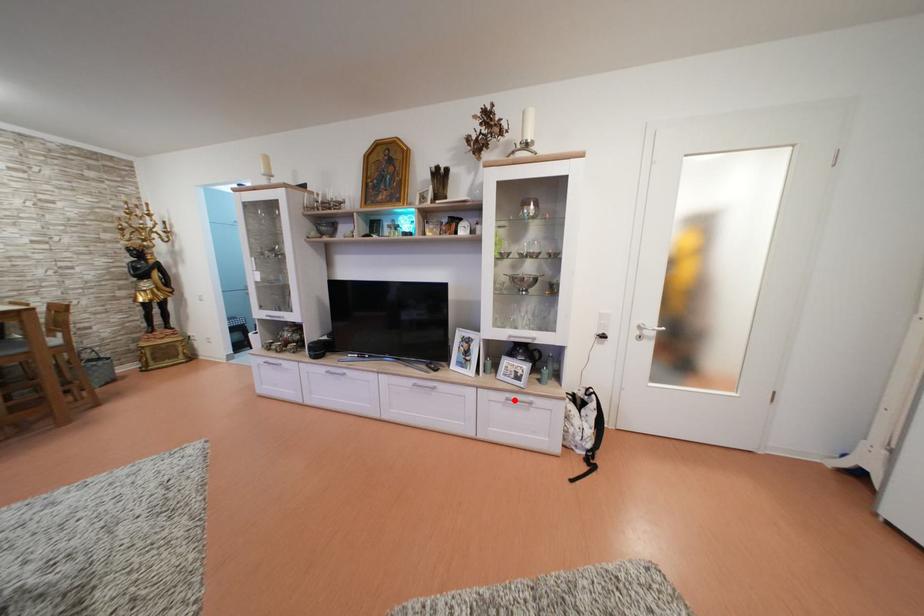
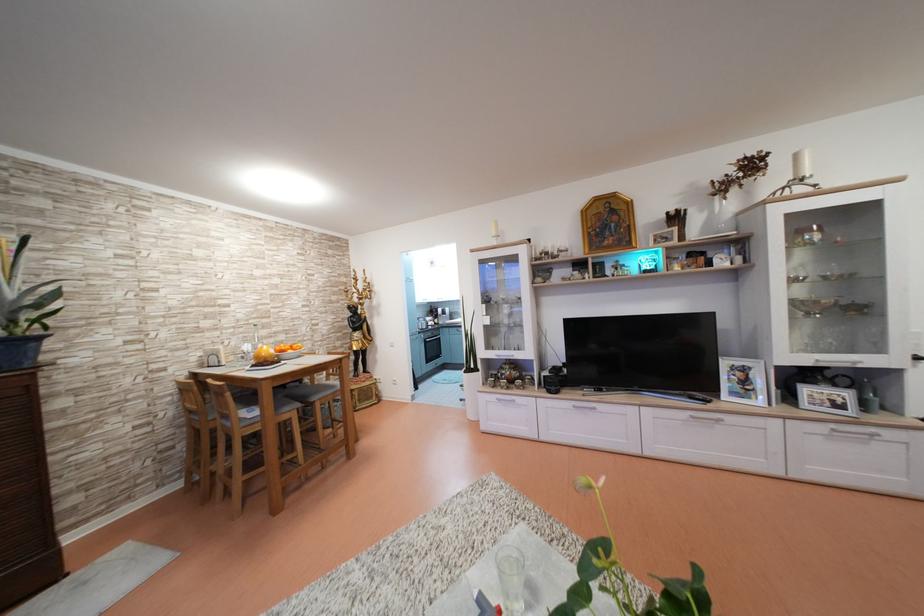
In the second image, find the point that corresponds to the highlighted location in the first image.

(840, 431)